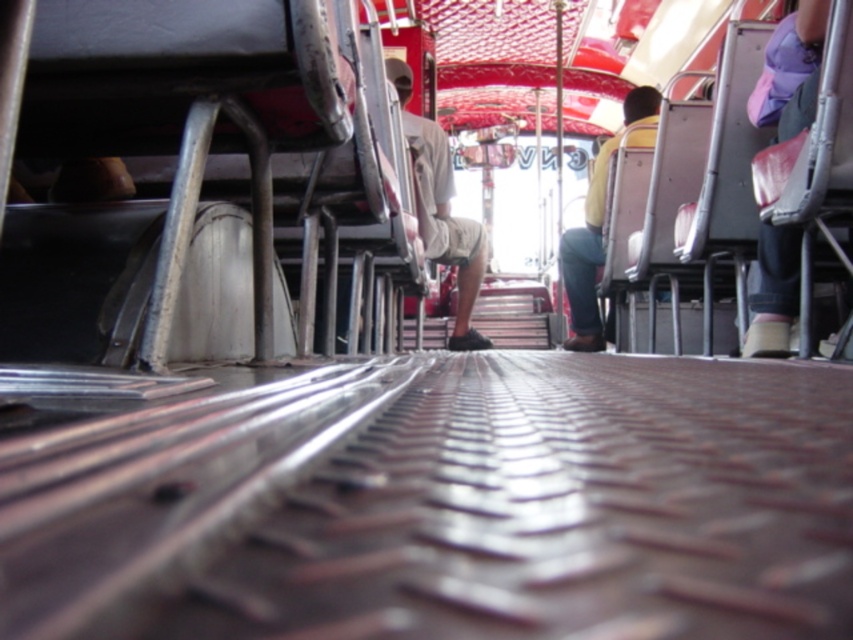
You are standing on the textured floor of the public transport vehicle and notice two people sitting in front of you. One is wearing khaki shorts at center and the other is wearing a yellow fabric shirt at center. Which clothing item is nearer to you?

The khaki shorts at center is closer to the viewer than the yellow fabric shirt at center, so the khaki shorts at center is nearer to you.

You are standing on the textured floor of a public transport vehicle and notice two items at the center area. Which item is positioned to the left when looking towards the front of the vehicle? The khaki shorts at center or the yellow fabric shirt at center?

The khaki shorts at center is to the left of the yellow fabric shirt at center when facing the front of the vehicle.

You are a passenger on a bus and you see a purple fabric cap at upper right and a yellow fabric shirt at center. Which object is smaller in size?

The purple fabric cap at upper right is smaller in size compared to the yellow fabric shirt at center.